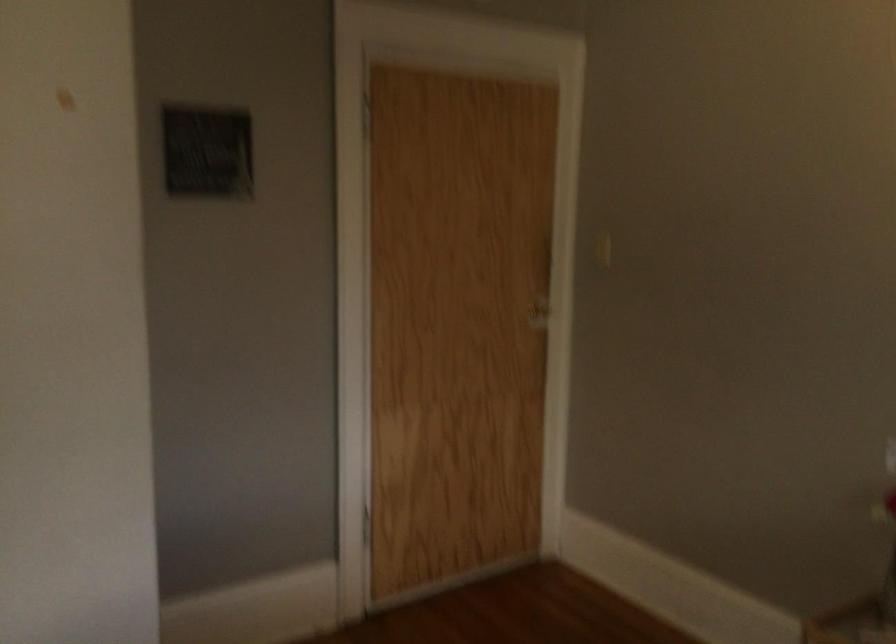
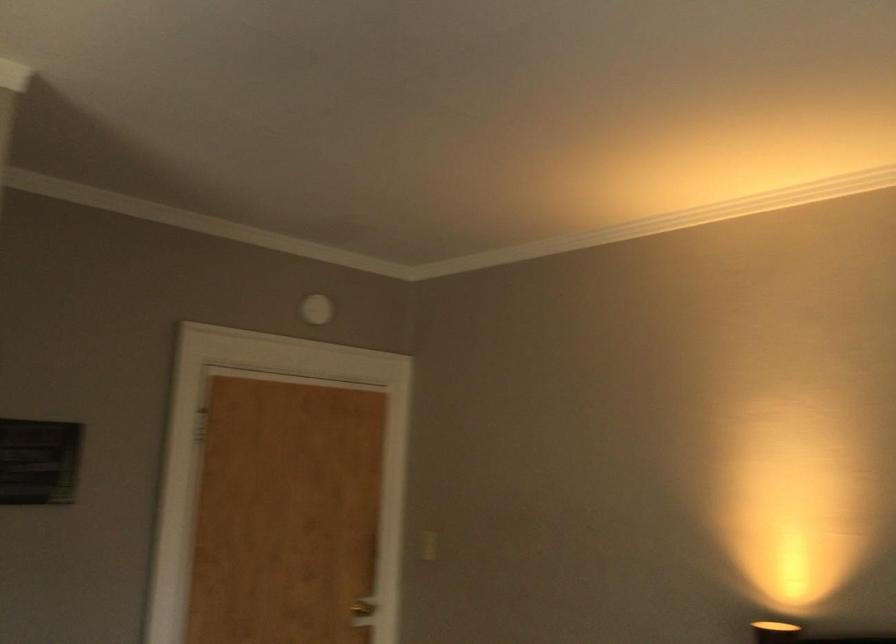
Question: Which direction would the cameraman need to move to produce the second image? Reply with the corresponding letter.

Choices:
 (A) Left
 (B) Right
 (C) Forward
 (D) Backward

Answer: (D)